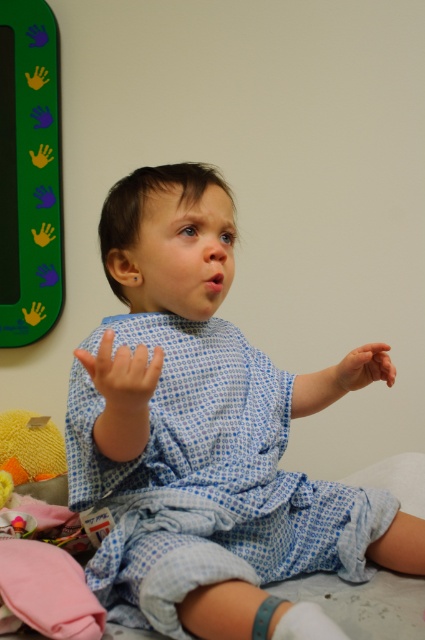
Question: Estimate the real-world distances between objects in this image. Which object is closer to the matte blue fabric hand at lower left?

Choices:
 (A) matte blue fabric hand at center
 (B) blue checkered gown at center
 (C) yellow fuzzy toy at lower left

Answer: (B)

Question: Is blue checkered gown at center smaller than matte blue fabric hand at lower left?

Choices:
 (A) no
 (B) yes

Answer: (A)

Question: Which of the following is the farthest from the observer?

Choices:
 (A) blue checkered gown at center
 (B) matte blue fabric hand at lower left

Answer: (A)

Question: Is yellow fuzzy toy at lower left positioned at the back of matte blue fabric hand at center?

Choices:
 (A) yes
 (B) no

Answer: (A)

Question: Which object is positioned farthest from the yellow fuzzy toy at lower left?

Choices:
 (A) matte blue fabric hand at lower left
 (B) matte blue fabric hand at center

Answer: (A)

Question: Does blue checkered gown at center appear over matte blue fabric hand at center?

Choices:
 (A) no
 (B) yes

Answer: (B)